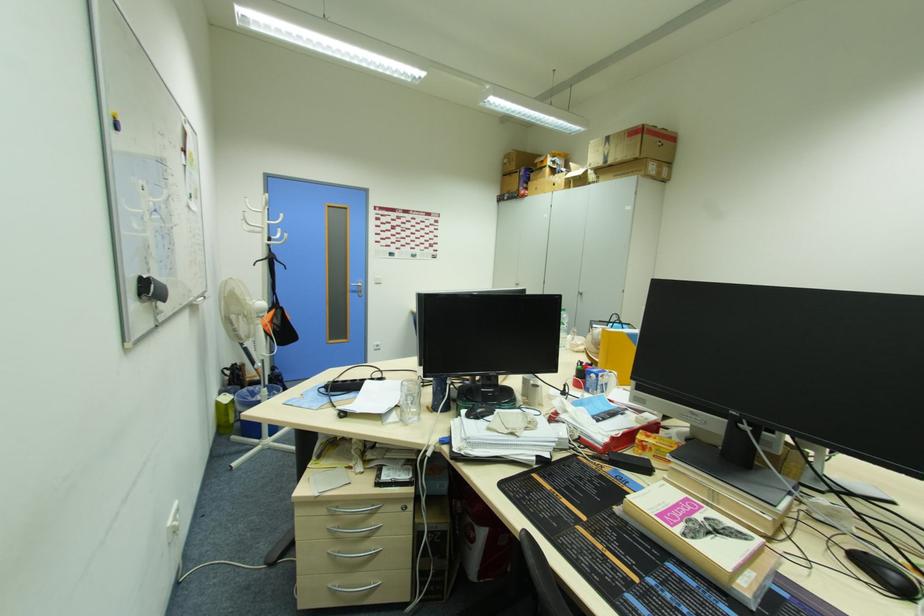
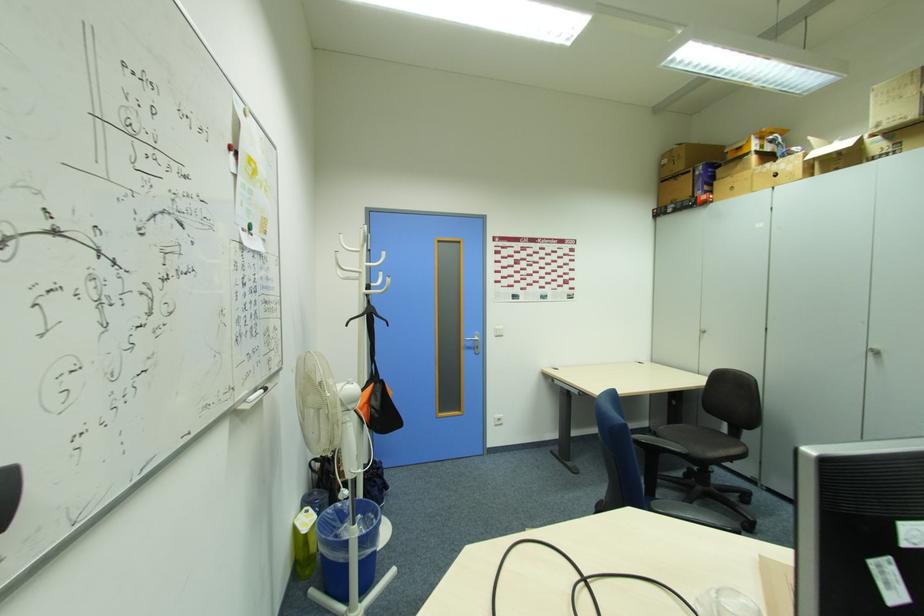
Where in the second image is the point corresponding to [249,391] from the first image?

(334, 512)